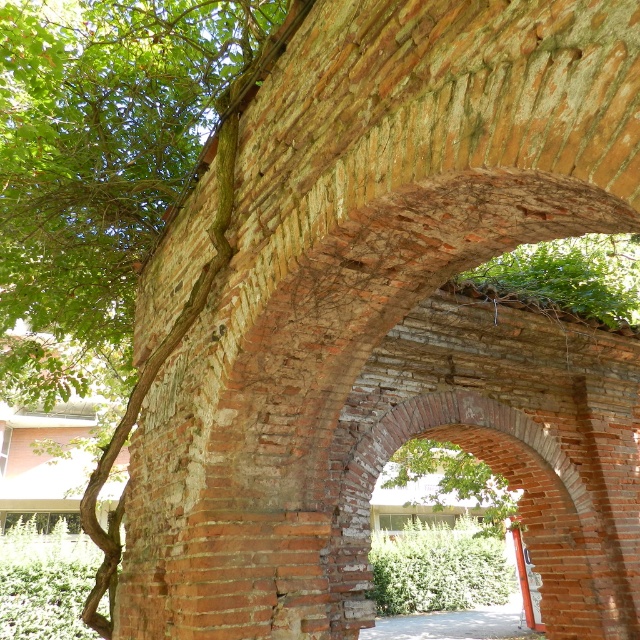
In the scene shown: You are an architect assessing the structural integrity of the brick archway. You notice the green leafy tree at center and the orange painted wood post at center. Which object has a narrower width?

The green leafy tree at center has a narrower width than the orange painted wood post at center.